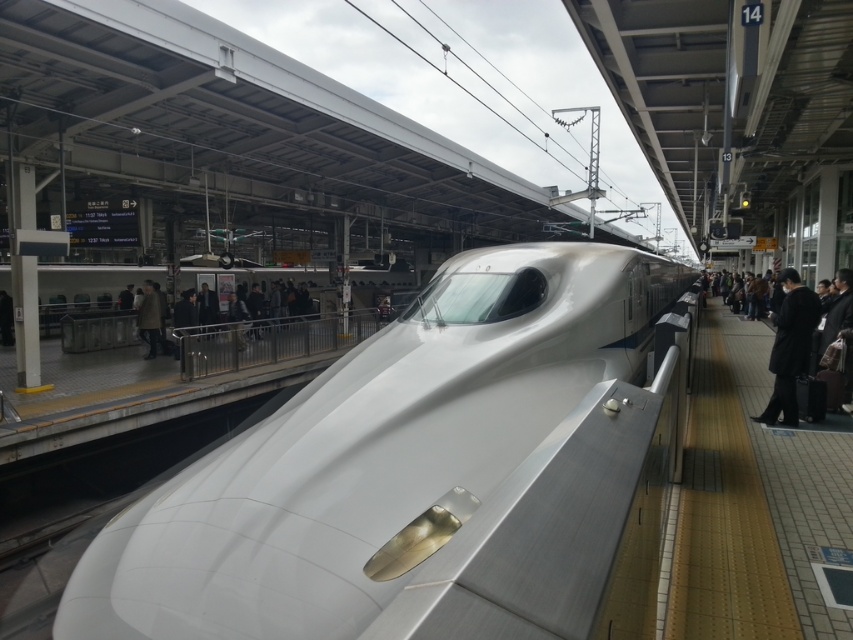
You are a passenger on the platform and want to board the train. You see the wooden platform at right and the dark gray suit at right. Which object is closer to the ground?

The wooden platform at right is closer to the ground because it is below the dark gray suit at right.

You are a passenger on the platform and want to board the white glossy bullet train at center. There is a person wearing a brown wool coat at center blocking your path. Can you walk around them to reach the train?

The white glossy bullet train at center is much larger than the brown wool coat at center, so yes, you can walk around the person wearing the brown wool coat at center to reach the train.